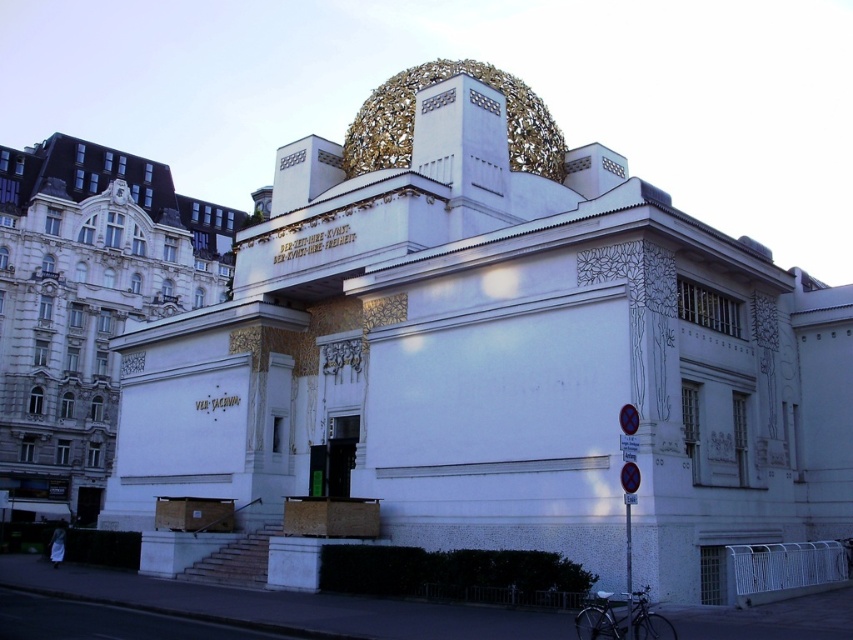
You are standing in front of the Secession Building in Vienna. You notice a point marked at coordinates [628,522]. What object is located at this point?

The point at coordinates [628,522] indicates the location of the metallic blue sign at lower right.

You are standing in front of the Secession Building in Vienna and notice the white stone building at lower left and the metallic blue sign at lower right. Which object is positioned to the left of the other?

The white stone building at lower left is to the left of the metallic blue sign at lower right according to the description.

In the scene shown: You are standing in front of the Secession Building in Vienna. You notice two points marked on the building. One is at coordinates point (90,269) and the other is at point (631,592). From your current position, which point is closer to you?

Point (631,592) is closer to you because it is in front of point (90,269).